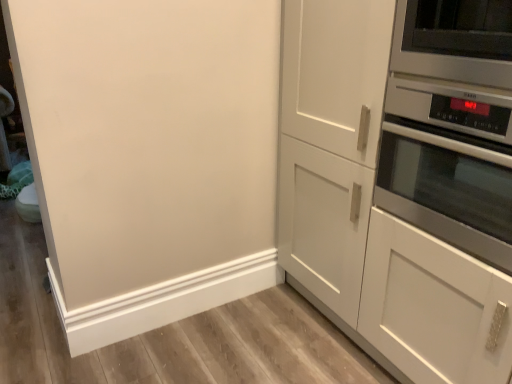
Question: Considering the relative sizes of white matte cabinet at right and stainless steel oven at right in the image provided, is white matte cabinet at right thinner than stainless steel oven at right?

Choices:
 (A) no
 (B) yes

Answer: (A)

Question: Is white matte cabinet at right oriented away from stainless steel oven at right?

Choices:
 (A) no
 (B) yes

Answer: (B)

Question: From a real-world perspective, is white matte cabinet at right beneath stainless steel oven at right?

Choices:
 (A) yes
 (B) no

Answer: (A)

Question: Does white matte cabinet at right appear on the right side of stainless steel oven at right?

Choices:
 (A) no
 (B) yes

Answer: (A)

Question: From the image's perspective, is white matte cabinet at right below stainless steel oven at right?

Choices:
 (A) yes
 (B) no

Answer: (A)

Question: Does white matte cabinet at right contain stainless steel oven at right?

Choices:
 (A) no
 (B) yes

Answer: (B)

Question: From a real-world perspective, is satin silver microwave at upper right on white matte cabinet at right?

Choices:
 (A) no
 (B) yes

Answer: (B)

Question: From a real-world perspective, is satin silver microwave at upper right beneath white matte cabinet at right?

Choices:
 (A) no
 (B) yes

Answer: (A)

Question: From the image's perspective, does satin silver microwave at upper right appear higher than white matte cabinet at right?

Choices:
 (A) no
 (B) yes

Answer: (B)

Question: Is satin silver microwave at upper right positioned beyond the bounds of white matte cabinet at right?

Choices:
 (A) yes
 (B) no

Answer: (B)

Question: From the image's perspective, would you say satin silver microwave at upper right is shown under white matte cabinet at right?

Choices:
 (A) no
 (B) yes

Answer: (A)

Question: Is satin silver microwave at upper right at the right side of white matte cabinet at right?

Choices:
 (A) no
 (B) yes

Answer: (B)

Question: Considering the relative positions of white matte cabinet at right and satin silver microwave at upper right in the image provided, is white matte cabinet at right to the left of satin silver microwave at upper right from the viewer's perspective?

Choices:
 (A) yes
 (B) no

Answer: (A)